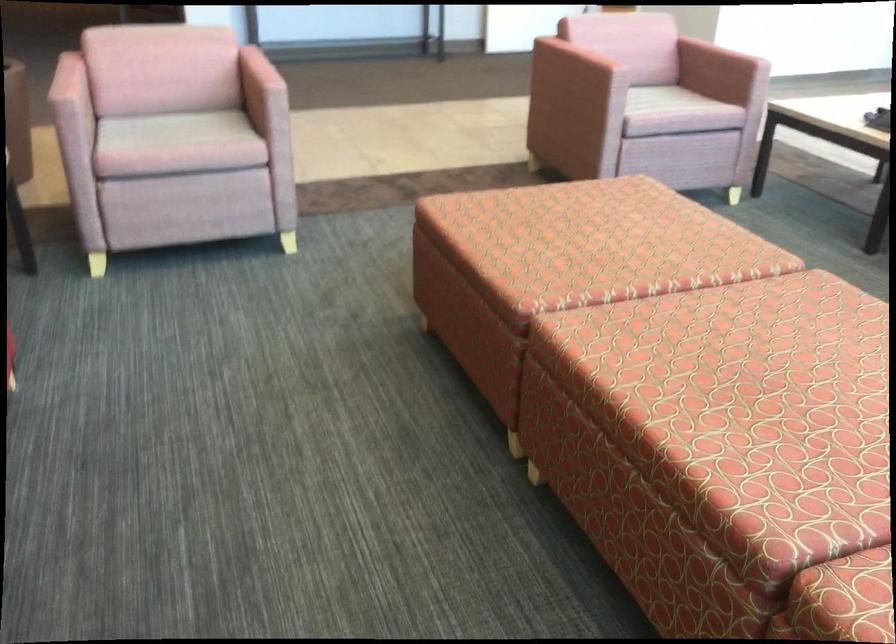
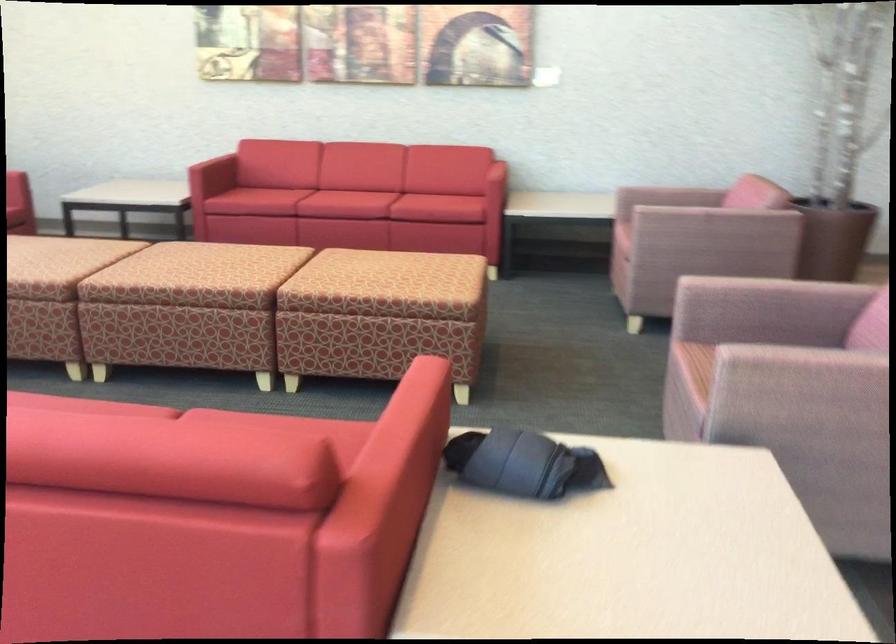
Question: I am providing you with two images of the same scene from different viewpoints. After the viewpoint changes to image2, which objects are now occluded?

Choices:
 (A) pink chair armrest
 (B) pink chair sitting surface
 (C) rolled up clothing
 (D) none of these

Answer: (D)